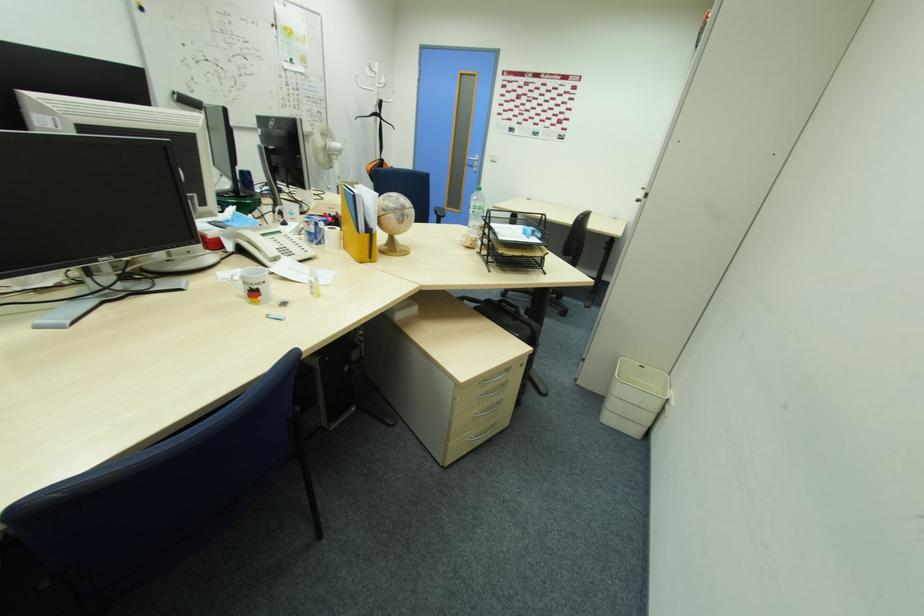
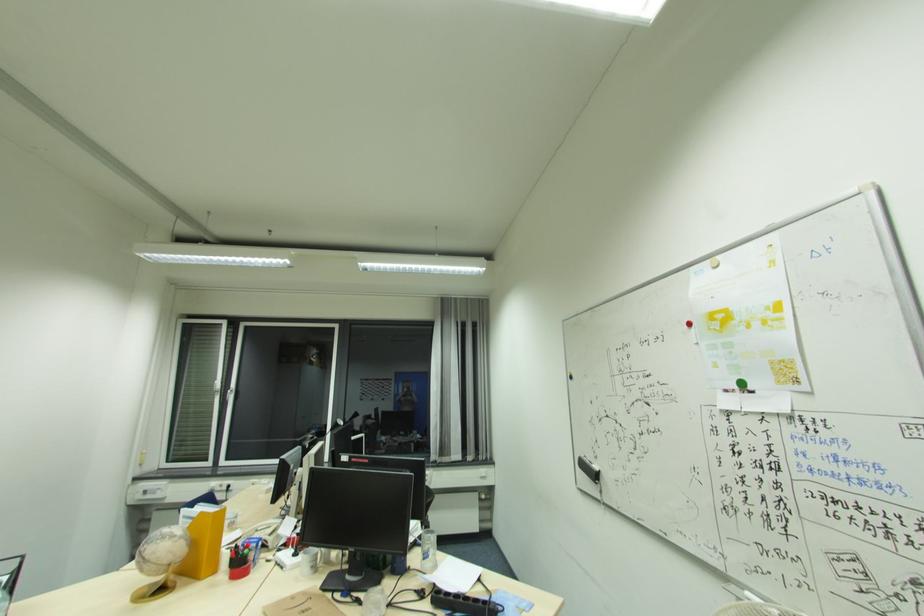
Locate, in the second image, the point that corresponds to pixel 293 62 in the first image.

(739, 387)